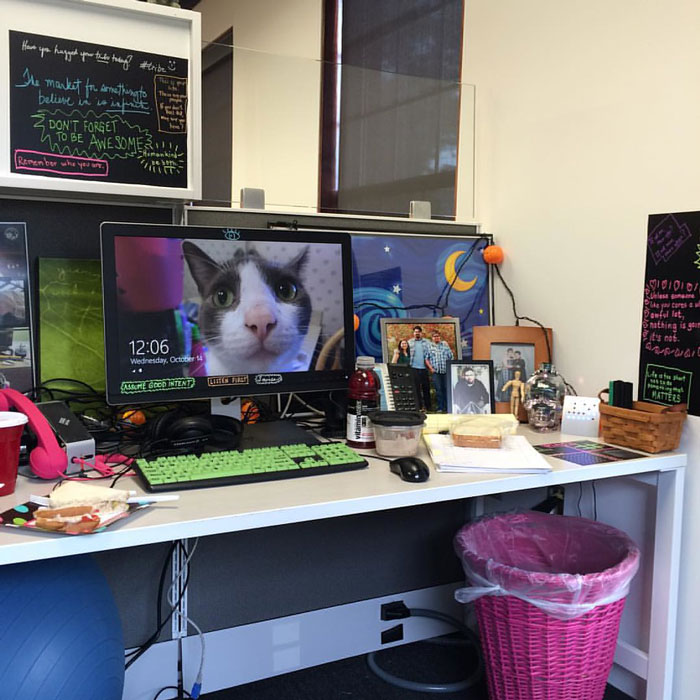
Locate an element on the screen. The image size is (700, 700). outlet is located at coordinates (388, 600).